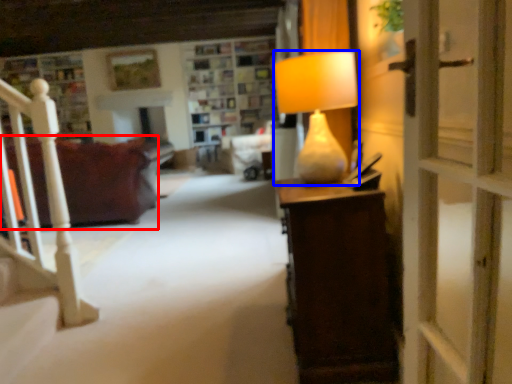
Question: Which point is closer to the camera, studio couch (highlighted by a red box) or lamp (highlighted by a blue box)?

Choices:
 (A) studio couch
 (B) lamp

Answer: (B)